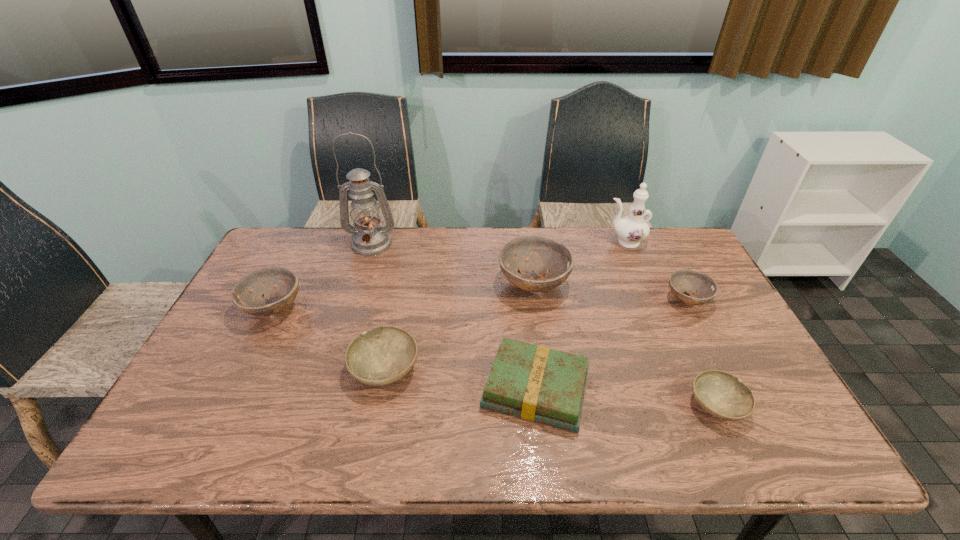
Locate an element on the screen. The width and height of the screenshot is (960, 540). object at the far right corner is located at coordinates (632, 229).

Locate an element on the screen. The image size is (960, 540). object that is positioned at the near right corner is located at coordinates (721, 394).

Find the location of a particular element. The image size is (960, 540). free space at the far edge of the desktop is located at coordinates (354, 261).

This screenshot has width=960, height=540. What are the coordinates of `vacant space at the near edge of the desktop` in the screenshot? It's located at (646, 430).

I want to click on free space at the left edge, so click(x=191, y=420).

Locate an element on the screen. This screenshot has width=960, height=540. vacant space at the right edge is located at coordinates (760, 421).

This screenshot has height=540, width=960. In order to click on free point at the far left corner in this screenshot , I will do `click(307, 228)`.

What are the coordinates of `vacant region between the chinaware and the fourth bowl from right to left` in the screenshot? It's located at (505, 305).

Locate an element on the screen. vacant area between the chinaware and the oil lamp is located at coordinates (498, 243).

Locate an element on the screen. vacant area that lies between the leftmost brown bowl and the smaller gray bowl is located at coordinates (495, 356).